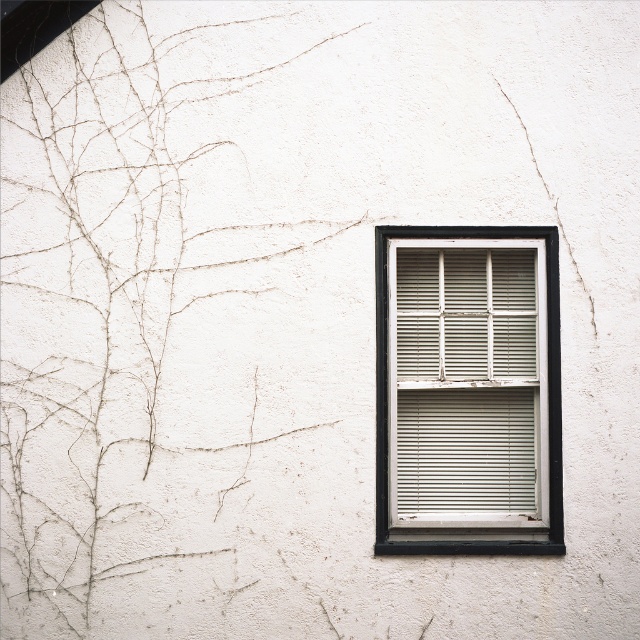
Question: Is brown textured ivy at upper left to the left of white painted wood window frame at center from the viewer's perspective?

Choices:
 (A) yes
 (B) no

Answer: (A)

Question: Considering the relative positions of brown textured ivy at upper left and white painted wood window frame at center in the image provided, where is brown textured ivy at upper left located with respect to white painted wood window frame at center?

Choices:
 (A) left
 (B) right

Answer: (A)

Question: Among these points, which one is farthest from the camera?

Choices:
 (A) click(x=154, y=260)
 (B) click(x=474, y=502)

Answer: (B)

Question: Which object appears closest to the camera in this image?

Choices:
 (A) white painted wood window frame at center
 (B) brown textured ivy at upper left

Answer: (B)

Question: Among these objects, which one is nearest to the camera?

Choices:
 (A) brown textured ivy at upper left
 (B) white painted wood window frame at center

Answer: (A)

Question: Observing the image, what is the correct spatial positioning of brown textured ivy at upper left in reference to white painted wood window frame at center?

Choices:
 (A) left
 (B) right

Answer: (A)